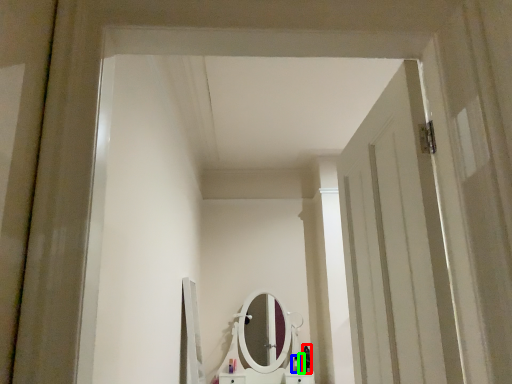
Question: Considering the real-world distances, which object is closest to toiletry (highlighted by a red box)? toiletry (highlighted by a blue box) or toiletry (highlighted by a green box).

Choices:
 (A) toiletry
 (B) toiletry

Answer: (B)